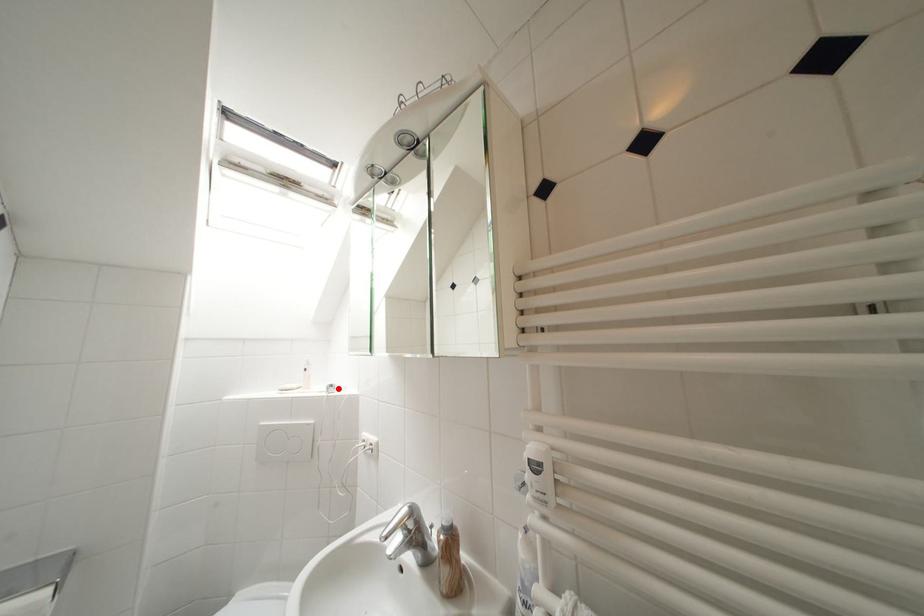
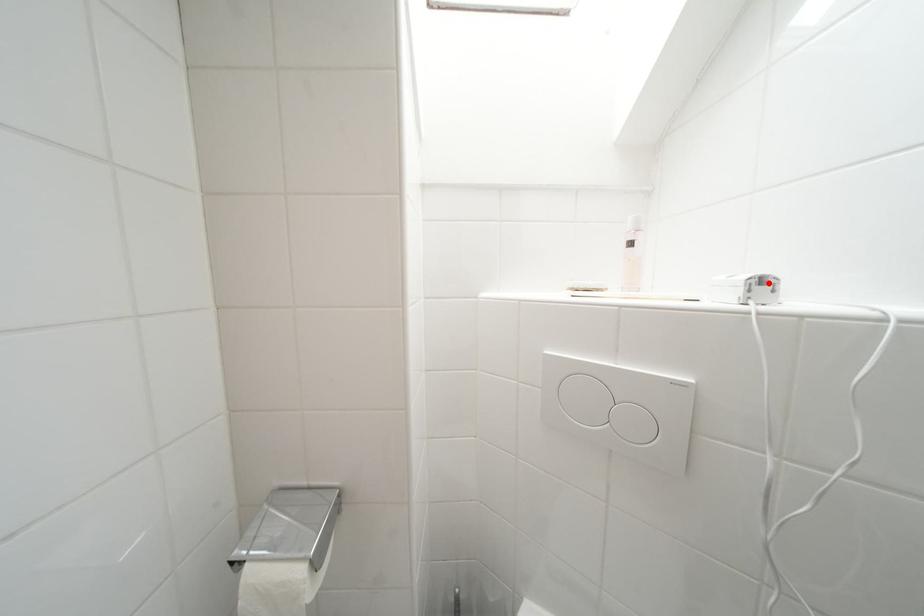
I am providing you with two images of the same scene from different viewpoints. A red point is marked on the first image and another point is marked on the second image. Does the point marked in image1 correspond to the same location as the one in image2?

Yes